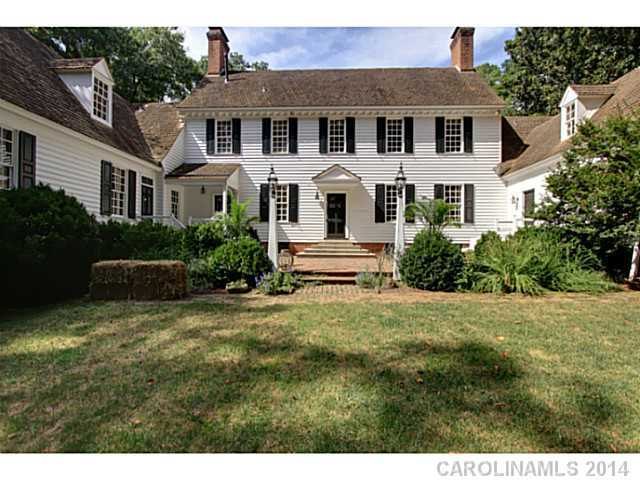
At what (x,y) coordinates should I click in order to perform the action: click on window. Please return your answer as a coordinate pair (x, y). The height and width of the screenshot is (480, 640). Looking at the image, I should click on (330, 123).